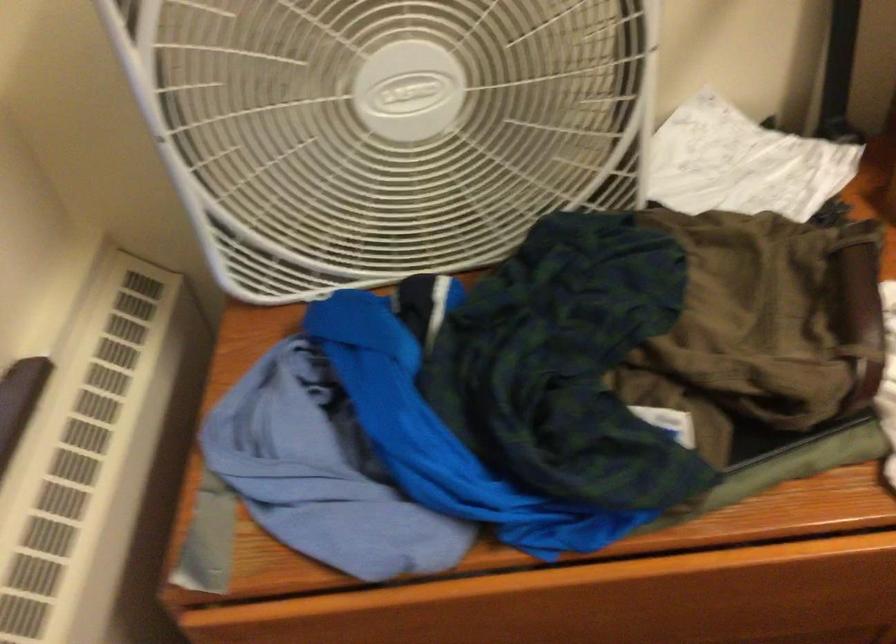
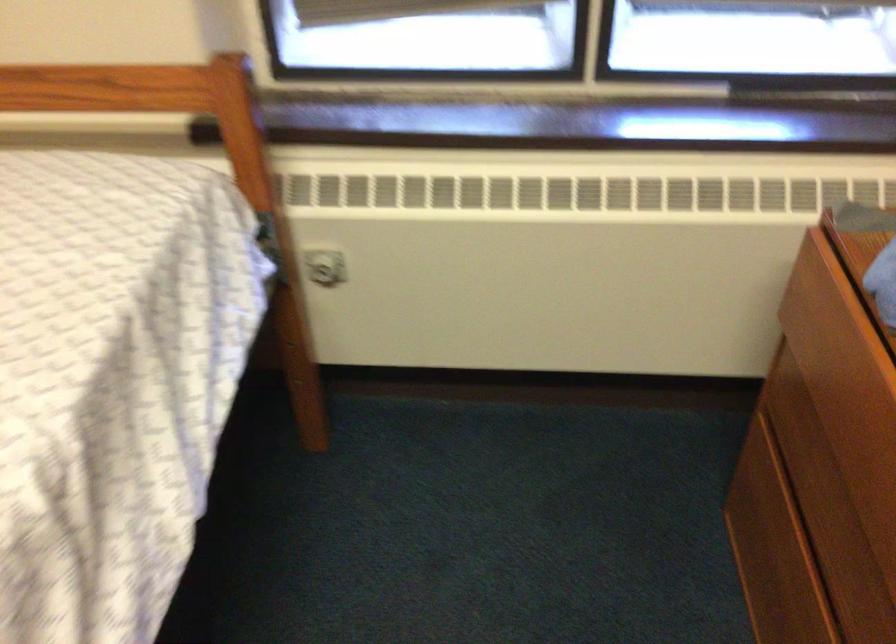
Based on the continuous images, in which direction is the camera rotating?

The camera's rotation is toward left-down.